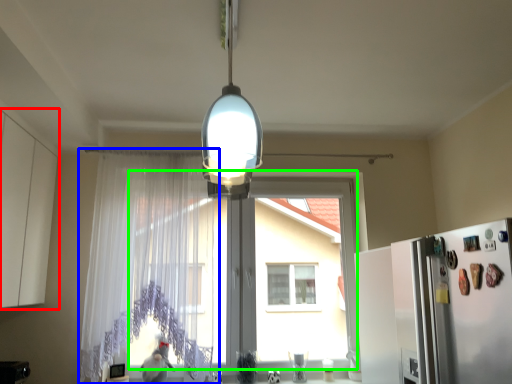
Question: Considering the real-world distances, which object is closest to cabinetry (highlighted by a red box)? curtain (highlighted by a blue box) or window screen (highlighted by a green box).

Choices:
 (A) curtain
 (B) window screen

Answer: (A)